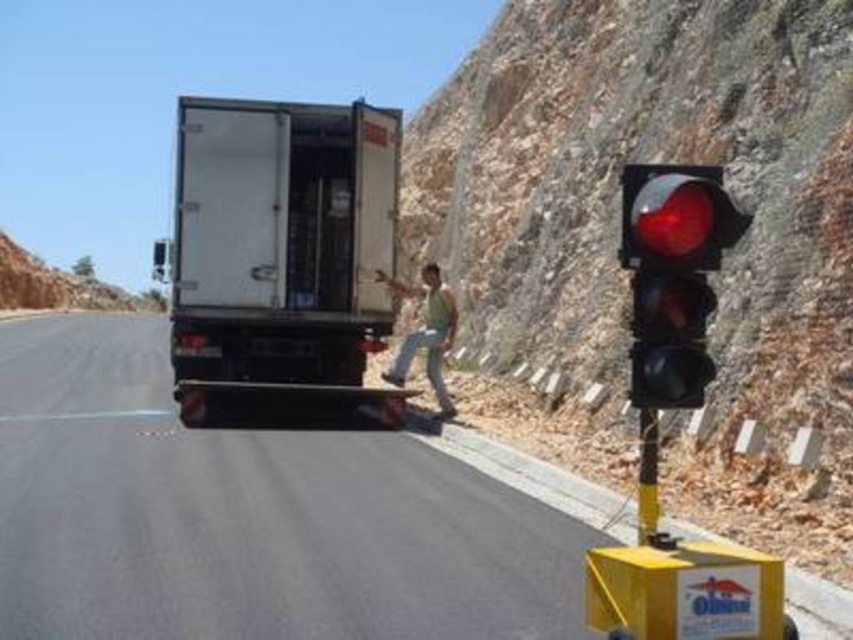
You are driving a car and see the red plastic traffic light at right and the green fabric shirt at center. Which object is taller?

The red plastic traffic light at right is taller than the green fabric shirt at center.

You are a delivery driver who needs to park your truck on the black rubber road at center. The truck requires a parking spot that is at least 1.5 meters wide. Can you park your truck here?

The black rubber road at center is located at point (259, 513), but the provided information does not specify the width of the road. Therefore, it is uncertain whether the truck can be parked there.